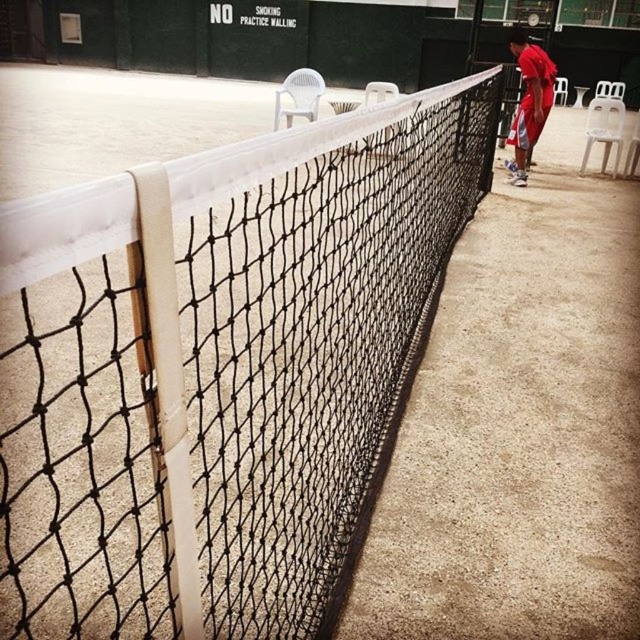
You are standing on the tennis court and see the point marked at coordinates (220, 369). What object is located at that point?

The point at coordinates (220, 369) indicates the black mesh net at center.

You are standing on the tennis court and see the black mesh net at center. If you want to locate it precisely, what are its coordinates?

The black mesh net at center is located at coordinates point (x=220, y=369).